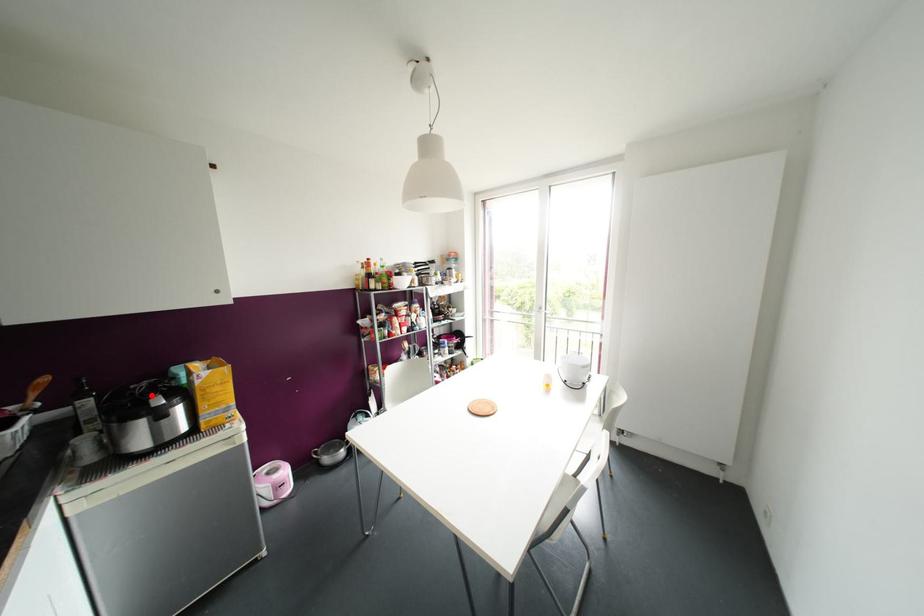
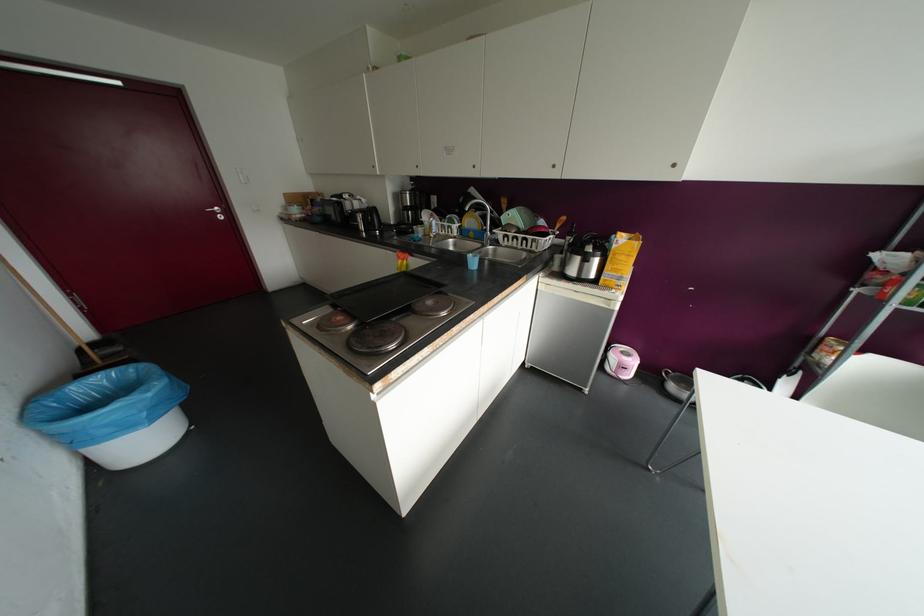
Question: I am providing you with two images of the same scene from different viewpoints. In image1, a red point is highlighted. Considering the same 3D point in image2, which of the following is correct?

Choices:
 (A) It is closer
 (B) It is farther

Answer: (A)